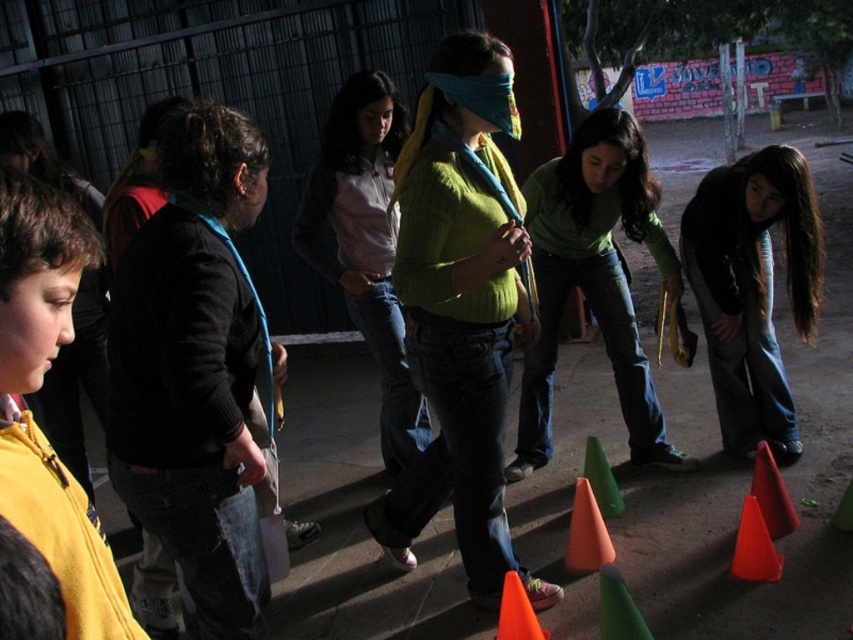
Question: Is knitted green sweater at center further to camera compared to orange plastic cone at lower right?

Choices:
 (A) no
 (B) yes

Answer: (A)

Question: Which point is farther to the camera?

Choices:
 (A) click(x=753, y=380)
 (B) click(x=780, y=556)

Answer: (A)

Question: Is smooth red traffic cone at lower right positioned before orange plastic cone at lower center?

Choices:
 (A) no
 (B) yes

Answer: (A)

Question: Does yellow fleece jacket at lower left have a greater width compared to orange plastic cone at lower center?

Choices:
 (A) no
 (B) yes

Answer: (A)

Question: Which point is closer to the camera taking this photo?

Choices:
 (A) (454, 253)
 (B) (624, 508)
 (C) (94, 531)

Answer: (C)

Question: Which point appears farthest from the camera in this image?

Choices:
 (A) (608, 515)
 (B) (775, 497)
 (C) (656, 232)

Answer: (C)